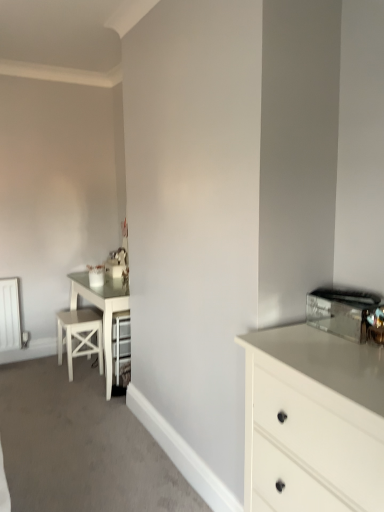
Question: Considering the relative sizes of white glossy chest of drawers at right and shiny metallic toaster at upper right in the image provided, is white glossy chest of drawers at right thinner than shiny metallic toaster at upper right?

Choices:
 (A) no
 (B) yes

Answer: (A)

Question: Does white glossy chest of drawers at right have a greater width compared to shiny metallic toaster at upper right?

Choices:
 (A) no
 (B) yes

Answer: (B)

Question: Does white glossy chest of drawers at right have a smaller size compared to shiny metallic toaster at upper right?

Choices:
 (A) no
 (B) yes

Answer: (A)

Question: Is white glossy chest of drawers at right completely or partially outside of shiny metallic toaster at upper right?

Choices:
 (A) yes
 (B) no

Answer: (A)

Question: Can you confirm if white glossy chest of drawers at right is taller than shiny metallic toaster at upper right?

Choices:
 (A) no
 (B) yes

Answer: (B)

Question: Is white glossy chest of drawers at right inside the boundaries of shiny metallic toaster at upper right, or outside?

Choices:
 (A) inside
 (B) outside

Answer: (B)

Question: Based on their positions, is white glossy chest of drawers at right located to the left or right of shiny metallic toaster at upper right?

Choices:
 (A) right
 (B) left

Answer: (B)

Question: In terms of size, does white glossy chest of drawers at right appear bigger or smaller than shiny metallic toaster at upper right?

Choices:
 (A) small
 (B) big

Answer: (B)

Question: Relative to shiny metallic toaster at upper right, is white glossy chest of drawers at right in front or behind?

Choices:
 (A) front
 (B) behind

Answer: (A)

Question: From a real-world perspective, is white wood bar stool at left positioned above or below white glossy chest of drawers at right?

Choices:
 (A) above
 (B) below

Answer: (B)

Question: In the image, is white wood bar stool at left on the left side or the right side of white glossy chest of drawers at right?

Choices:
 (A) left
 (B) right

Answer: (A)

Question: Relative to white glossy chest of drawers at right, is white wood bar stool at left in front or behind?

Choices:
 (A) front
 (B) behind

Answer: (B)

Question: Would you say white wood bar stool at left is inside or outside white glossy chest of drawers at right?

Choices:
 (A) outside
 (B) inside

Answer: (A)

Question: Considering their positions, is white wood bar stool at left located in front of or behind shiny metallic toaster at upper right?

Choices:
 (A) behind
 (B) front

Answer: (A)

Question: Is white wood bar stool at left taller or shorter than shiny metallic toaster at upper right?

Choices:
 (A) short
 (B) tall

Answer: (B)